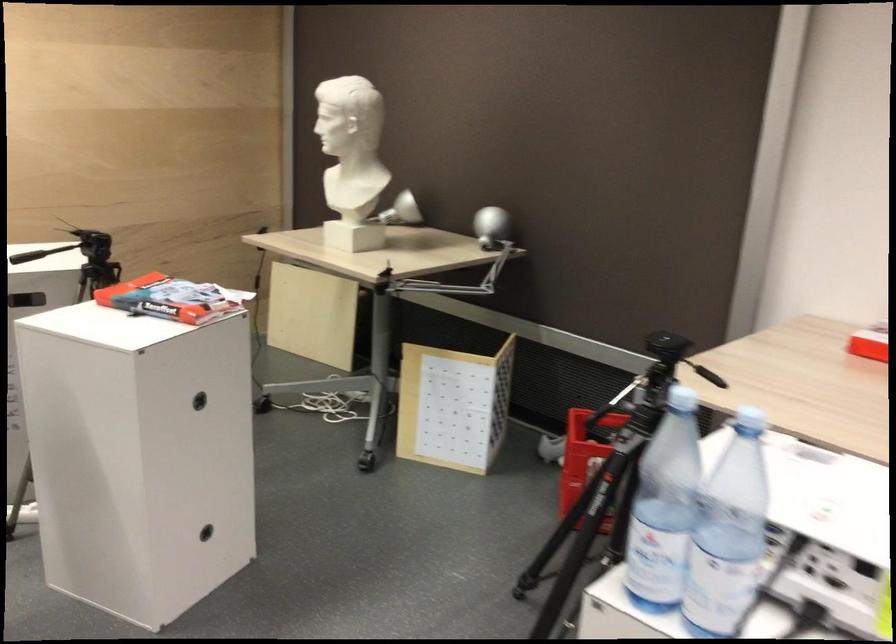
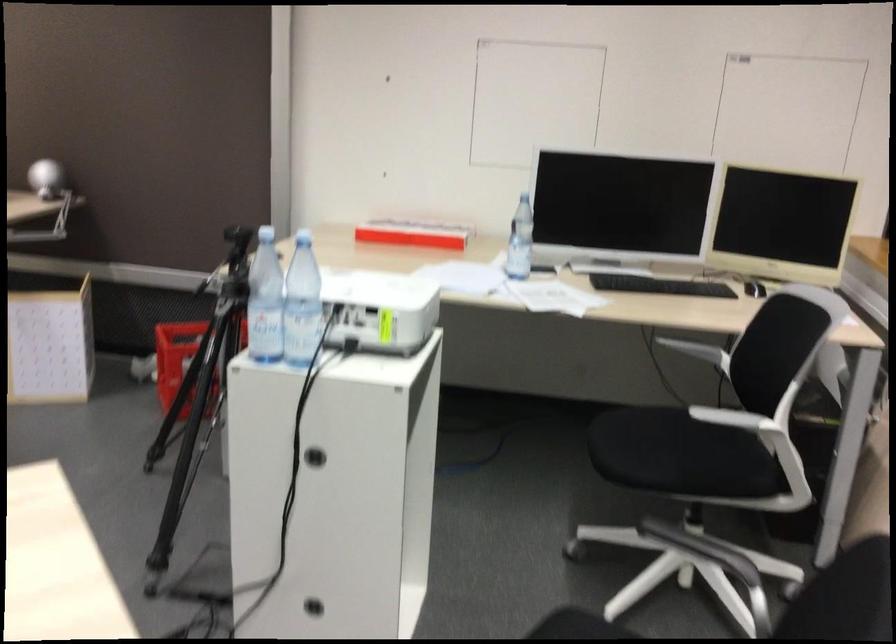
Locate, in the second image, the point that corresponds to point 588,447 in the first image.

(179, 359)